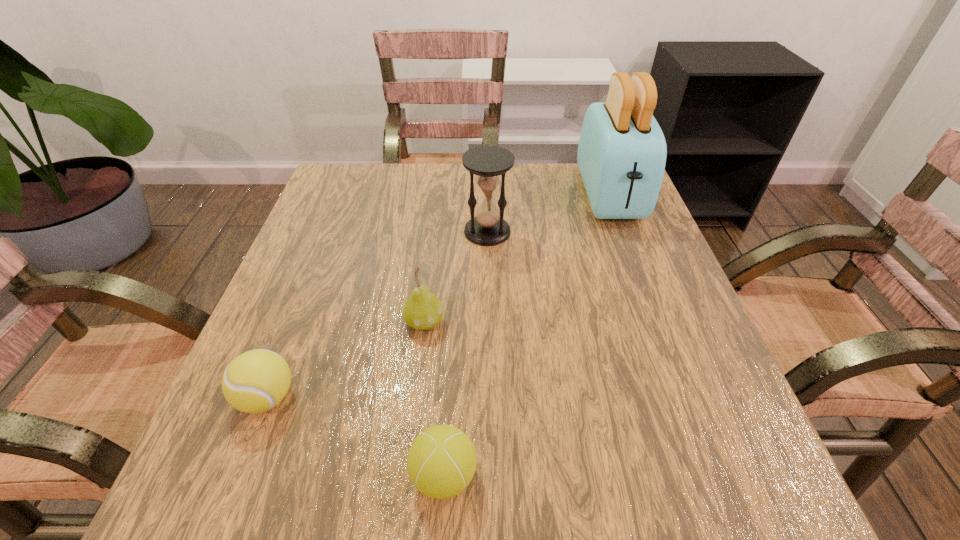
Image resolution: width=960 pixels, height=540 pixels. Identify the location of the tallest object. (622, 151).

This screenshot has width=960, height=540. Identify the location of the rightmost object. (622, 151).

At what (x,y) coordinates should I click in order to perform the action: click on the second tallest object. Please return your answer as a coordinate pair (x, y). Looking at the image, I should click on (488, 164).

Find the location of a particular element. The image size is (960, 540). pear is located at coordinates (423, 310).

This screenshot has width=960, height=540. I want to click on the third shortest object, so click(x=423, y=310).

Where is `the second nearest object`? the second nearest object is located at coordinates (255, 381).

Find the location of a particular element. The image size is (960, 540). the farther tennis ball is located at coordinates (255, 381).

Locate an element on the screen. The height and width of the screenshot is (540, 960). the nearer tennis ball is located at coordinates 441,462.

This screenshot has width=960, height=540. Find the location of `the right tennis ball`. the right tennis ball is located at coordinates (441, 462).

What are the coordinates of `vacant space located on the side of the rightmost object with the lever` in the screenshot? It's located at (655, 315).